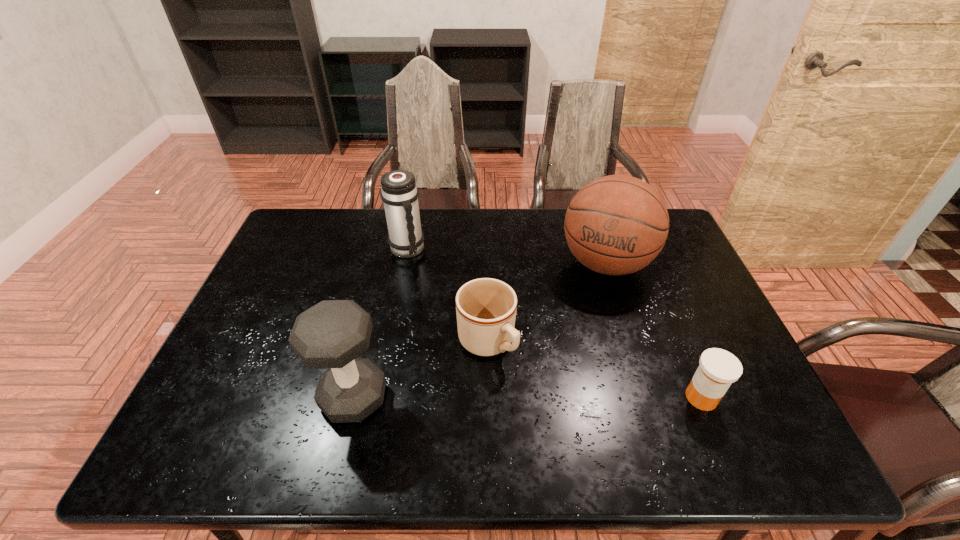
Locate an element on the screen. The width and height of the screenshot is (960, 540). basketball that is at the far edge is located at coordinates (615, 225).

Find the location of a particular element. The image size is (960, 540). dumbbell present at the near edge is located at coordinates (331, 334).

The width and height of the screenshot is (960, 540). What are the coordinates of `medicine positioned at the near edge` in the screenshot? It's located at (718, 369).

You are a GUI agent. You are given a task and a screenshot of the screen. Output one action in this format:
    pyautogui.click(x=<x>, y=<y>)
    Task: Click on the medicine that is at the right edge
    
    Given the screenshot: What is the action you would take?
    pyautogui.click(x=718, y=369)

You are a GUI agent. You are given a task and a screenshot of the screen. Output one action in this format:
    pyautogui.click(x=<x>, y=<y>)
    Task: Click on the basketball positioned at the right edge
    The image size is (960, 540).
    Given the screenshot: What is the action you would take?
    pyautogui.click(x=615, y=225)

Where is `object located at the far right corner`? object located at the far right corner is located at coordinates (615, 225).

The image size is (960, 540). Find the location of `object at the near right corner`. object at the near right corner is located at coordinates (718, 369).

Locate an element on the screen. blank space at the far edge is located at coordinates (490, 229).

You are a GUI agent. You are given a task and a screenshot of the screen. Output one action in this format:
    pyautogui.click(x=<x>, y=<y>)
    Task: Click on the vacant space at the near edge of the desktop
    
    Given the screenshot: What is the action you would take?
    pyautogui.click(x=586, y=400)

Find the location of a particular element. vacant space at the left edge of the desktop is located at coordinates (284, 283).